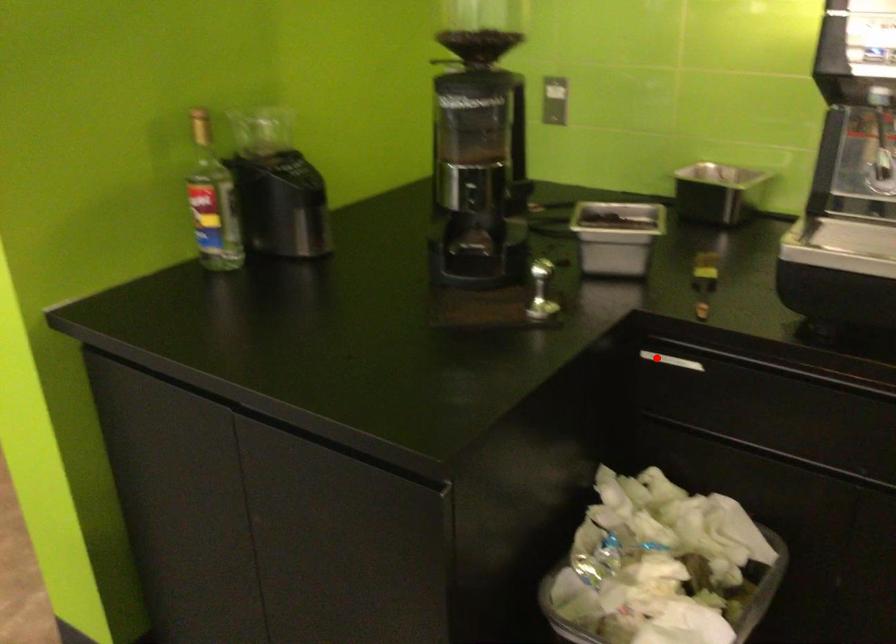
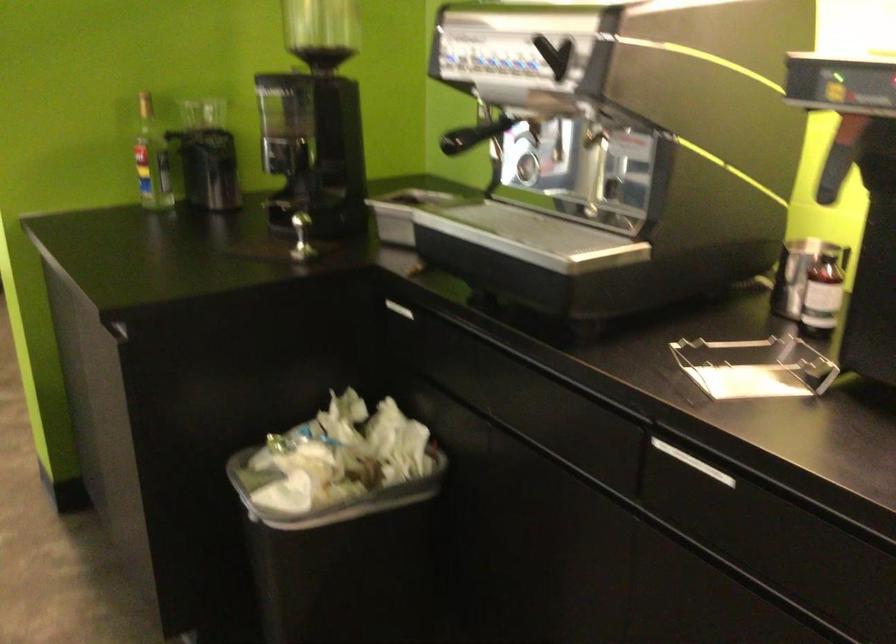
Where in the second image is the point corresponding to the highlighted location from the first image?

(394, 308)